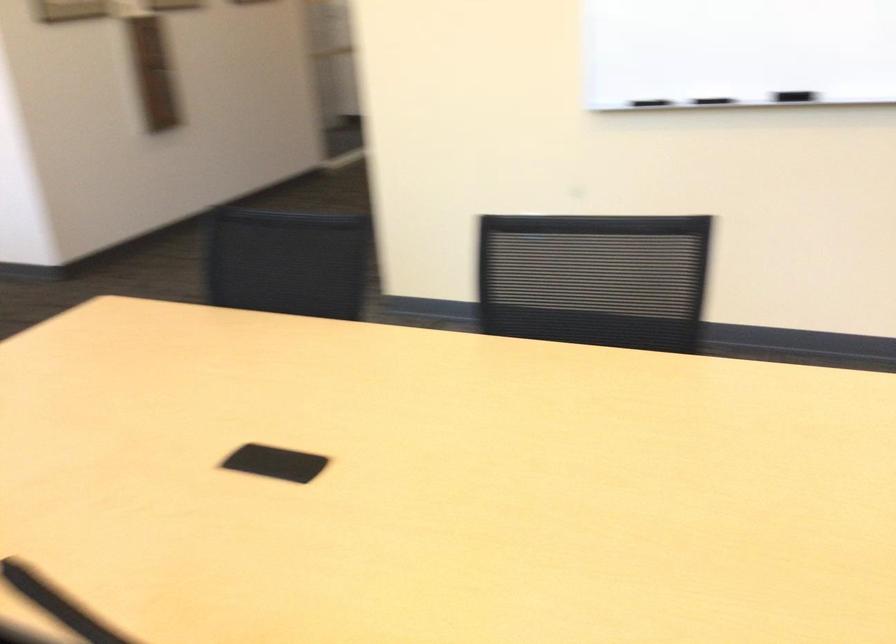
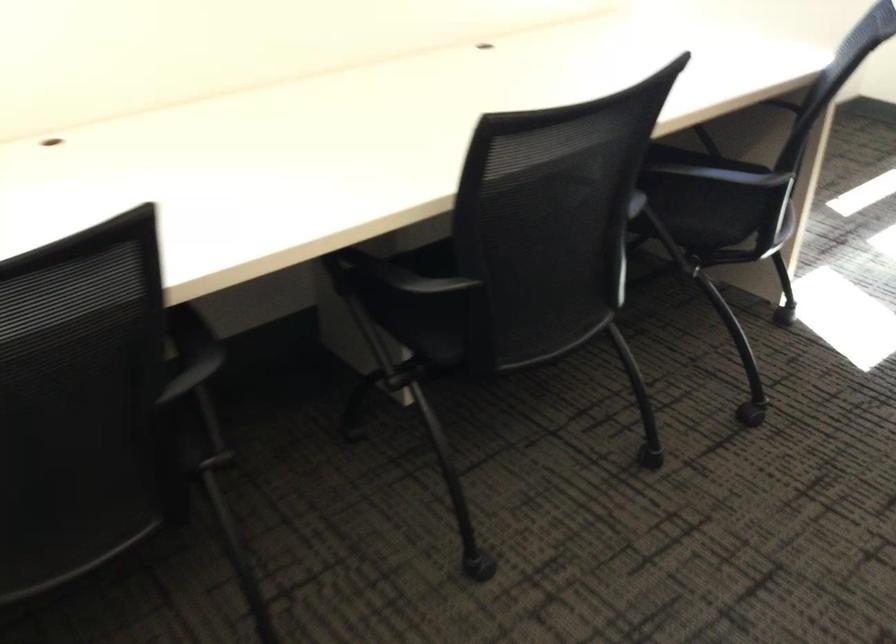
How did the camera likely rotate?

The camera rotated toward left-down.